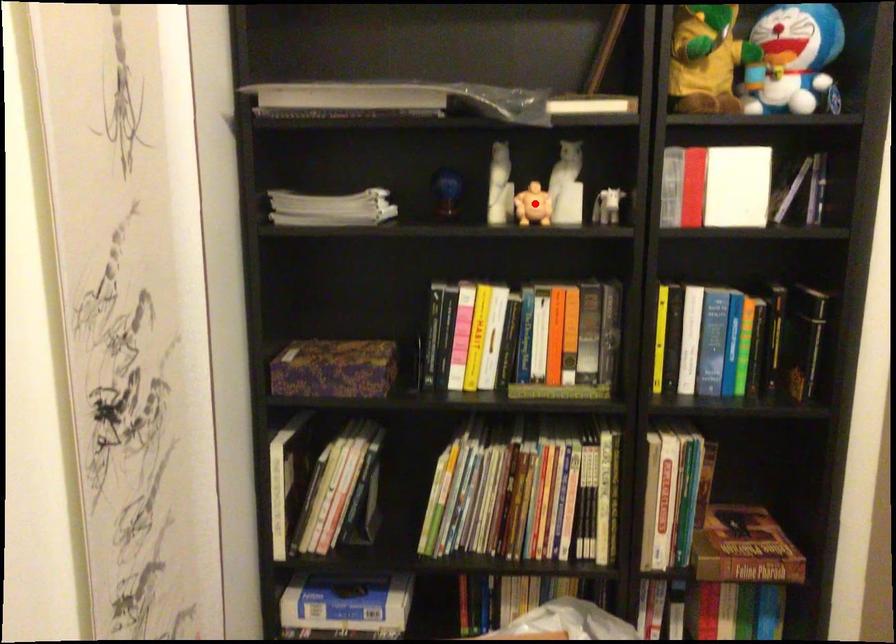
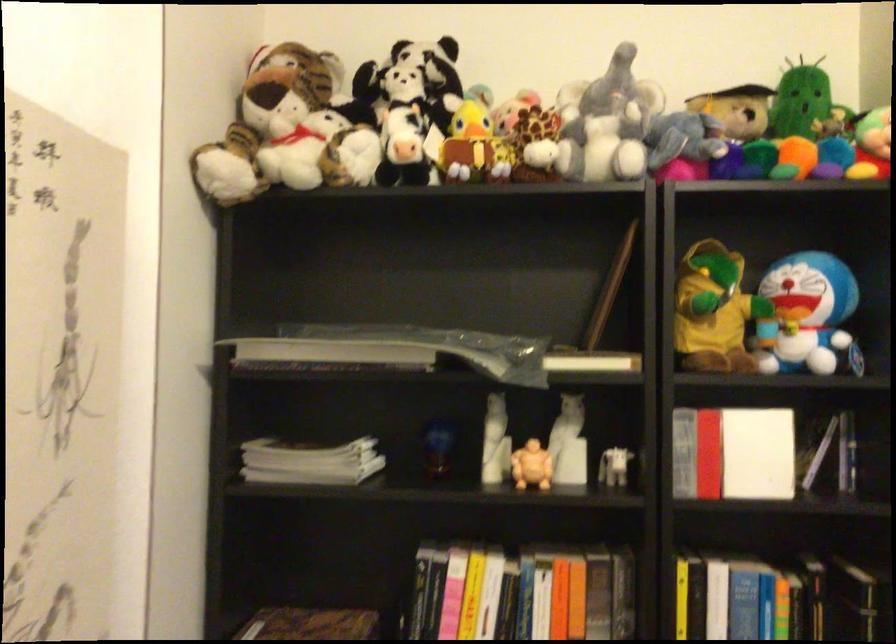
Question: I am providing you with two images of the same scene from different viewpoints. A red point is shown in image1. For the corresponding object point in image2, is it positioned nearer or farther from the camera?

Choices:
 (A) Nearer
 (B) Farther

Answer: (A)